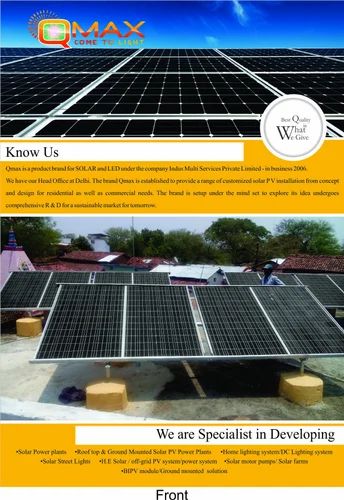
Where is `rag`? The width and height of the screenshot is (344, 500). rag is located at coordinates (66, 398).